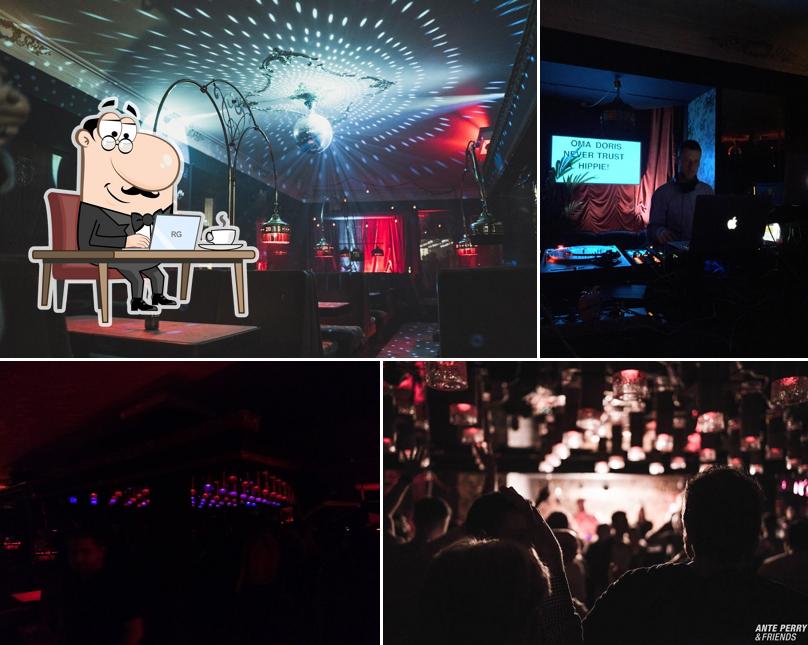
In order to click on lamp in this screenshot , I will do `click(276, 233)`.